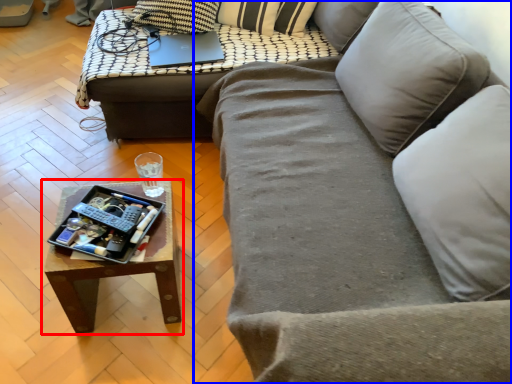
Question: Which object appears farthest to the camera in this image, coffee table (highlighted by a red box) or studio couch (highlighted by a blue box)?

Choices:
 (A) coffee table
 (B) studio couch

Answer: (A)